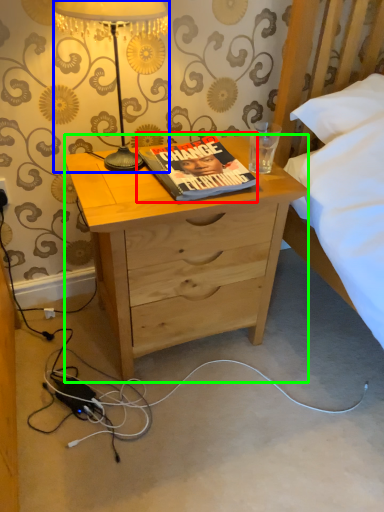
Question: Which object is positioned closest to book (highlighted by a red box)? Select from lamp (highlighted by a blue box) and desk (highlighted by a green box).

Choices:
 (A) lamp
 (B) desk

Answer: (B)